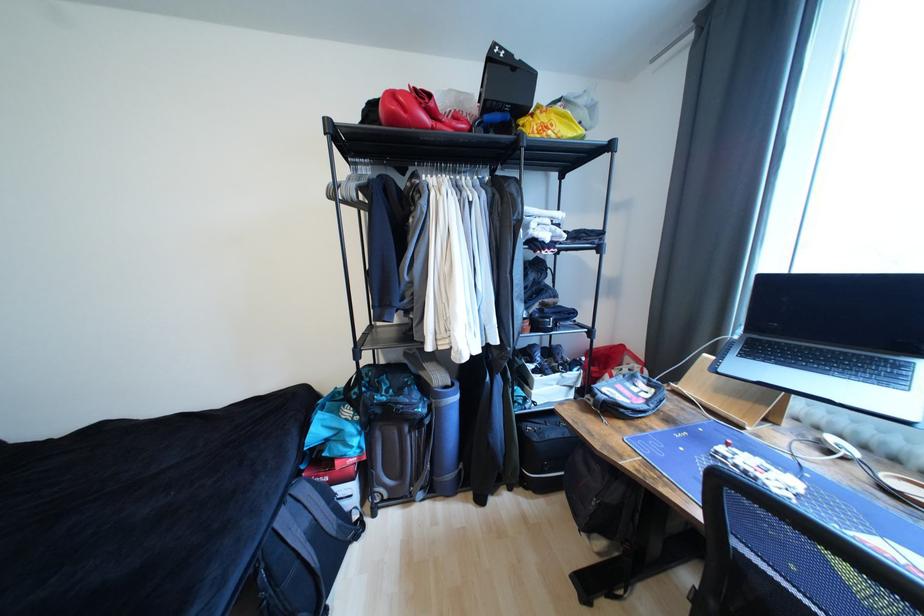
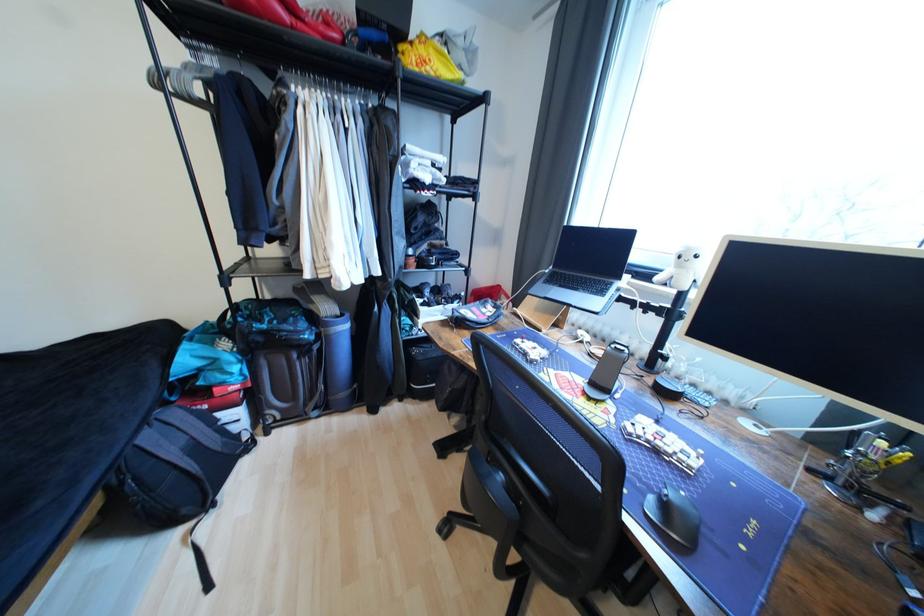
Find the pixel in the second image that matches (289,520) in the first image.

(155, 439)